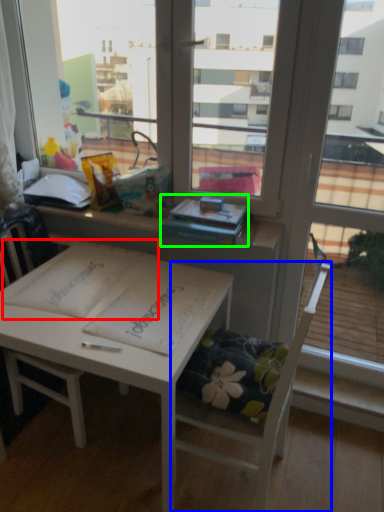
Question: Which object is the farthest from notebook (highlighted by a red box)? Choose among these: chair (highlighted by a blue box) or book (highlighted by a green box).

Choices:
 (A) chair
 (B) book

Answer: (A)